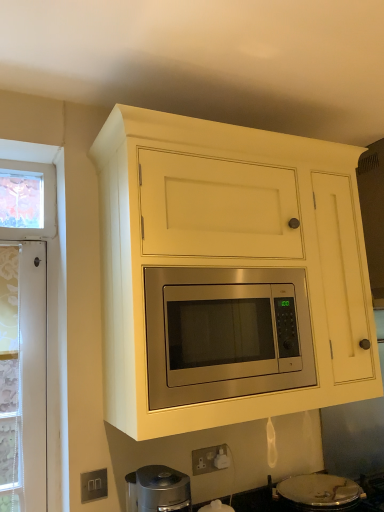
This screenshot has height=512, width=384. What do you see at coordinates (225, 333) in the screenshot? I see `stainless steel microwave at center` at bounding box center [225, 333].

What do you see at coordinates (228, 274) in the screenshot? This screenshot has width=384, height=512. I see `matte yellow cabinet at center` at bounding box center [228, 274].

What do you see at coordinates (309, 504) in the screenshot?
I see `silver metallic gas stove at lower center` at bounding box center [309, 504].

This screenshot has height=512, width=384. What are the coordinates of `satin silver outlet at lower left` in the screenshot? It's located at (94, 485).

Is stainless steel microwave at center positioned far away from satin silver outlet at lower left?

That's not correct — stainless steel microwave at center is a little close to satin silver outlet at lower left.

Is stainless steel microwave at center positioned beyond the bounds of satin silver outlet at lower left?

Yes.

Does stainless steel microwave at center turn towards satin silver outlet at lower left?

No, stainless steel microwave at center is not oriented towards satin silver outlet at lower left.

Is stainless steel microwave at center positioned in front of satin silver outlet at lower left?

Yes.

Is silver metallic gas stove at lower center turned away from satin silver outlet at lower left?

No, silver metallic gas stove at lower center is not facing the opposite direction of satin silver outlet at lower left.

The height and width of the screenshot is (512, 384). I want to click on electric outlet located on the left of silver metallic gas stove at lower center, so click(94, 485).

Which is in front, silver metallic gas stove at lower center or satin silver outlet at lower left?

silver metallic gas stove at lower center is more forward.

From a real-world perspective, which object rests below the other?

silver metallic gas stove at lower center is physically lower.

Considering the relative sizes of silver metallic gas stove at lower center and matte yellow cabinet at center in the image provided, is silver metallic gas stove at lower center shorter than matte yellow cabinet at center?

Correct, silver metallic gas stove at lower center is not as tall as matte yellow cabinet at center.

Between silver metallic gas stove at lower center and matte yellow cabinet at center, which one has smaller size?

With smaller size is silver metallic gas stove at lower center.

Is matte yellow cabinet at center inside silver metallic gas stove at lower center?

No, matte yellow cabinet at center is not inside silver metallic gas stove at lower center.

From the image's perspective, is matte yellow cabinet at center under stainless steel microwave at center?

No.

In terms of height, does matte yellow cabinet at center look taller or shorter compared to stainless steel microwave at center?

matte yellow cabinet at center is taller than stainless steel microwave at center.

From a real-world perspective, between matte yellow cabinet at center and stainless steel microwave at center, who is vertically higher?

matte yellow cabinet at center, from a real-world perspective.

Who is more distant, stainless steel microwave at center or silver metallic gas stove at lower center?

silver metallic gas stove at lower center is behind.

Where is `microwave oven located above the silver metallic gas stove at lower center (from a real-world perspective)`? The width and height of the screenshot is (384, 512). microwave oven located above the silver metallic gas stove at lower center (from a real-world perspective) is located at coordinates (225, 333).

In the image, is stainless steel microwave at center on the left side or the right side of silver metallic gas stove at lower center?

stainless steel microwave at center is positioned on silver metallic gas stove at lower center's left side.

From the picture: Is stainless steel microwave at center spatially inside silver metallic gas stove at lower center, or outside of it?

stainless steel microwave at center is spatially situated outside silver metallic gas stove at lower center.

Considering the sizes of objects matte yellow cabinet at center and satin silver outlet at lower left in the image provided, who is wider, matte yellow cabinet at center or satin silver outlet at lower left?

matte yellow cabinet at center.

Where is `electric outlet below the matte yellow cabinet at center (from a real-world perspective)`? The image size is (384, 512). electric outlet below the matte yellow cabinet at center (from a real-world perspective) is located at coordinates (94, 485).

Based on the photo, is matte yellow cabinet at center far away from satin silver outlet at lower left?

matte yellow cabinet at center is near satin silver outlet at lower left, not far away.

Which is behind, point (290, 300) or point (122, 166)?

Positioned behind is point (290, 300).

How different are the orientations of stainless steel microwave at center and matte yellow cabinet at center in degrees?

The facing directions of stainless steel microwave at center and matte yellow cabinet at center are 0.4 degrees apart.

Are stainless steel microwave at center and matte yellow cabinet at center making contact?

No, stainless steel microwave at center is not with matte yellow cabinet at center.

From the image's perspective, is stainless steel microwave at center under matte yellow cabinet at center?

Correct, stainless steel microwave at center appears lower than matte yellow cabinet at center in the image.

At what (x,y) coordinates should I click in order to perform the action: click on electric outlet directly beneath the stainless steel microwave at center (from a real-world perspective). Please return your answer as a coordinate pair (x, y). The height and width of the screenshot is (512, 384). Looking at the image, I should click on (94, 485).

Find the location of a particular element. The image size is (384, 512). electric outlet lying on the left of silver metallic gas stove at lower center is located at coordinates (x=94, y=485).

Looking at the image, which one is located further to matte yellow cabinet at center, stainless steel microwave at center or silver metallic gas stove at lower center?

Among the two, silver metallic gas stove at lower center is located further to matte yellow cabinet at center.

Considering their positions, is stainless steel microwave at center positioned closer to silver metallic gas stove at lower center than matte yellow cabinet at center?

Among the two, stainless steel microwave at center is located nearer to silver metallic gas stove at lower center.

From the image, which object appears to be nearer to satin silver outlet at lower left, matte yellow cabinet at center or stainless steel microwave at center?

stainless steel microwave at center lies closer to satin silver outlet at lower left than the other object.

Which object lies nearer to the anchor point matte yellow cabinet at center, satin silver outlet at lower left or silver metallic gas stove at lower center?

Among the two, silver metallic gas stove at lower center is located nearer to matte yellow cabinet at center.

When comparing their distances from satin silver outlet at lower left, does silver metallic gas stove at lower center or matte yellow cabinet at center seem further?

matte yellow cabinet at center.

From the image, which object appears to be farther from matte yellow cabinet at center, satin silver outlet at lower left or stainless steel microwave at center?

satin silver outlet at lower left lies further to matte yellow cabinet at center than the other object.

Based on their spatial positions, is silver metallic gas stove at lower center or matte yellow cabinet at center further from stainless steel microwave at center?

silver metallic gas stove at lower center is positioned further to the anchor stainless steel microwave at center.

Based on their spatial positions, is satin silver outlet at lower left or matte yellow cabinet at center further from silver metallic gas stove at lower center?

The object further to silver metallic gas stove at lower center is matte yellow cabinet at center.

Locate an element on the screen. The image size is (384, 512). microwave oven between satin silver outlet at lower left and silver metallic gas stove at lower center from left to right is located at coordinates (225, 333).

Locate an element on the screen. Image resolution: width=384 pixels, height=512 pixels. microwave oven between matte yellow cabinet at center and silver metallic gas stove at lower center from top to bottom is located at coordinates (225, 333).

Where is `microwave oven that lies between matte yellow cabinet at center and satin silver outlet at lower left from top to bottom`? microwave oven that lies between matte yellow cabinet at center and satin silver outlet at lower left from top to bottom is located at coordinates (225, 333).

What are the coordinates of `electric outlet between matte yellow cabinet at center and silver metallic gas stove at lower center vertically` in the screenshot? It's located at (94, 485).